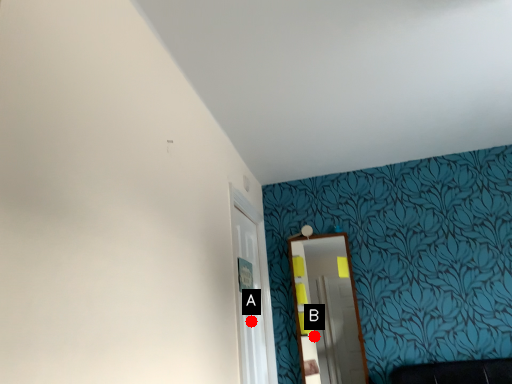
Question: Two points are circled on the image, labeled by A and B beside each circle. Which point is closer to the camera?

Choices:
 (A) A is closer
 (B) B is closer

Answer: (A)